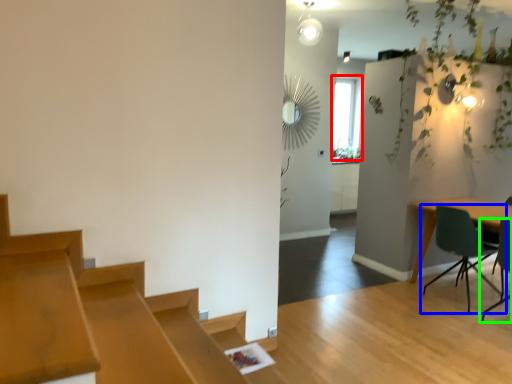
Question: Based on their relative distances, which object is nearer to window (highlighted by a red box)? Choose from chair (highlighted by a blue box) and chair (highlighted by a green box).

Choices:
 (A) chair
 (B) chair

Answer: (A)